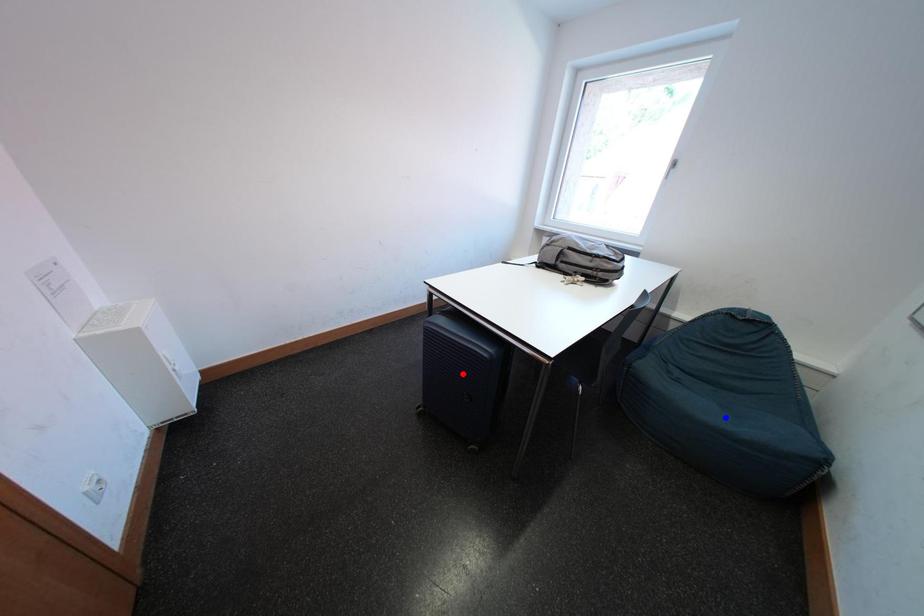
Question: In the image, two points are highlighted. Which point is nearer to the camera? Reply with the corresponding letter.

Choices:
 (A) blue point
 (B) red point

Answer: (B)